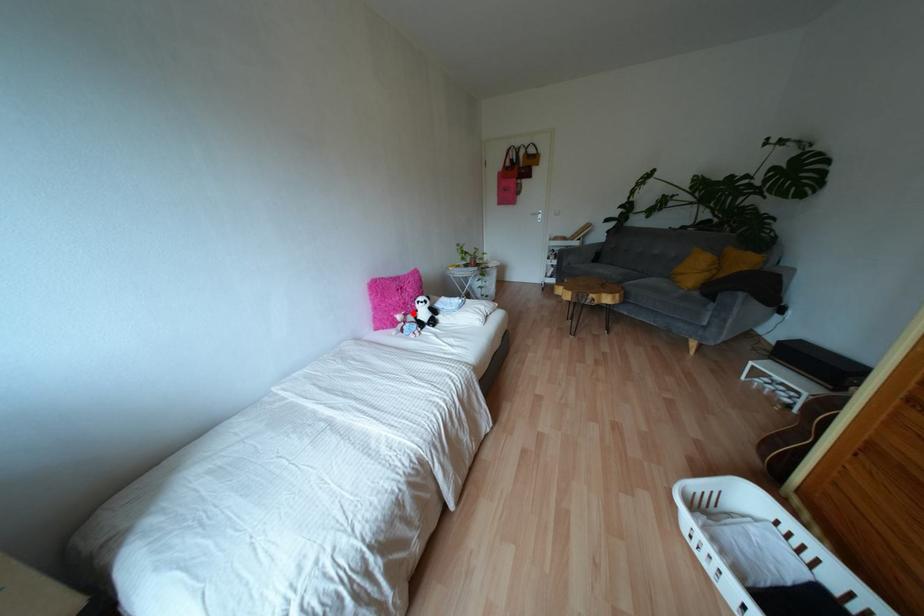
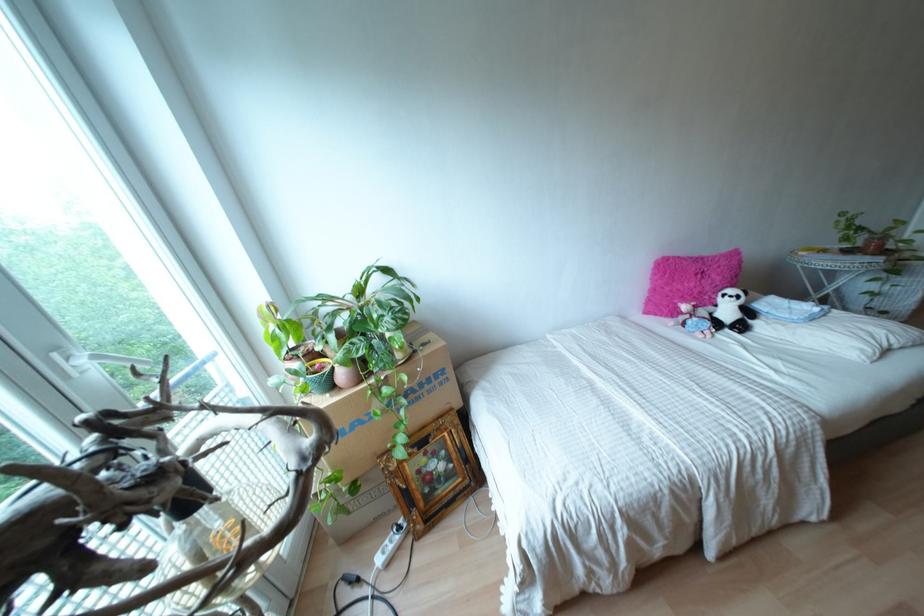
The point at the highlighted location is marked in the first image. Where is the corresponding point in the second image?

(710, 308)